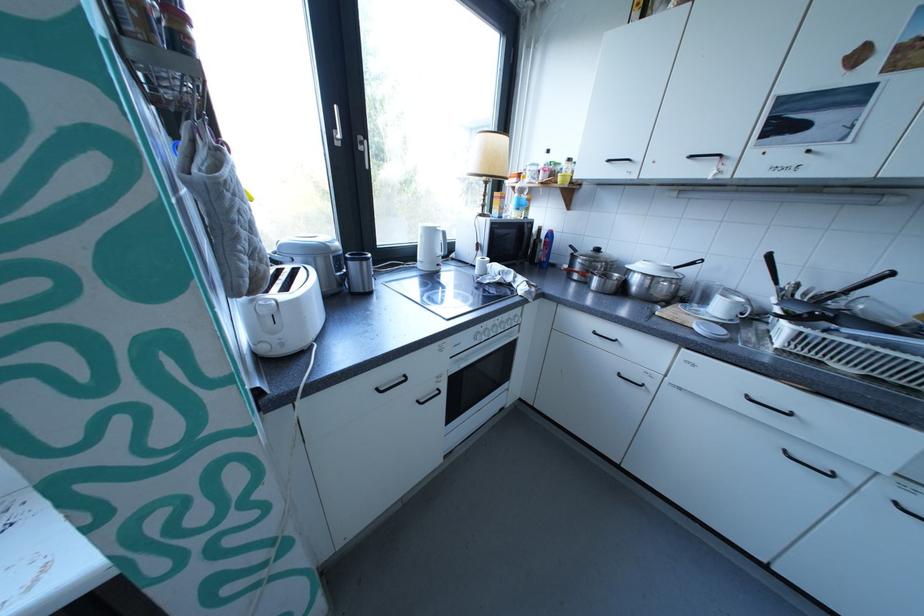
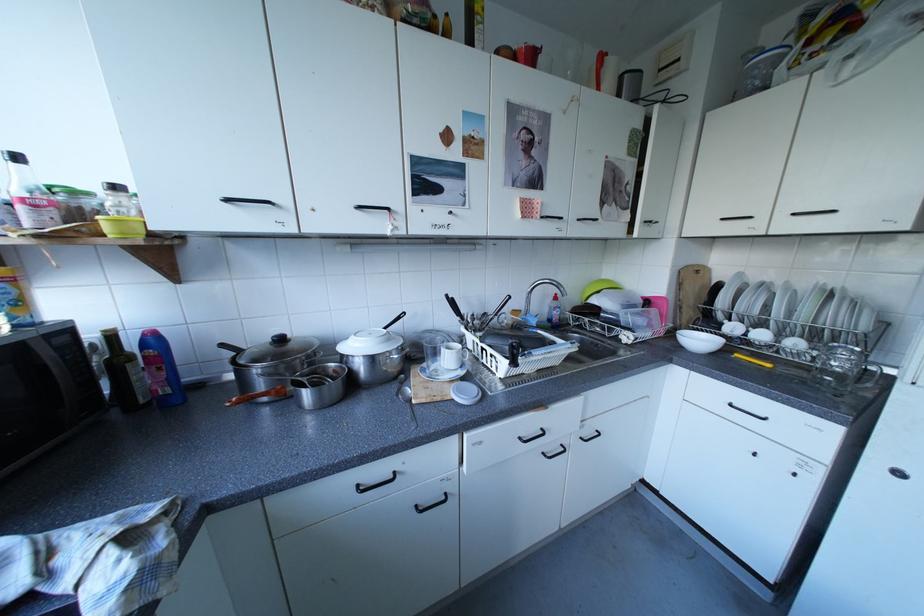
Question: How did the camera likely rotate?

Choices:
 (A) Left
 (B) Right
 (C) Up
 (D) Down

Answer: (B)